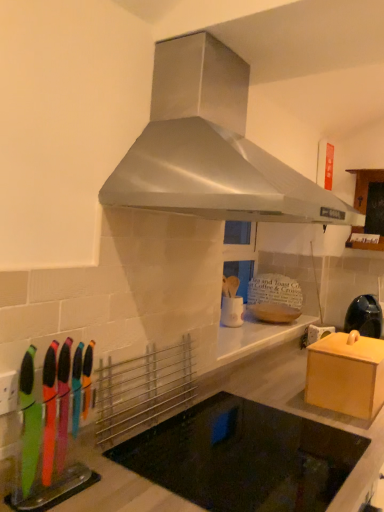
Question: Is there a large distance between wooden cabinet at upper right, positioned as the 2th cabinetry in bottom-to-top order, and matte black kettle at right?

Choices:
 (A) no
 (B) yes

Answer: (A)

Question: Is wooden cabinet at upper right, positioned as the 2th cabinetry in front-to-back order, located outside matte black kettle at right?

Choices:
 (A) no
 (B) yes

Answer: (B)

Question: Is wooden cabinet at upper right, acting as the first cabinetry starting from the right, looking in the opposite direction of matte black kettle at right?

Choices:
 (A) no
 (B) yes

Answer: (A)

Question: From the image's perspective, is wooden cabinet at upper right, arranged as the first cabinetry when viewed from the back, under matte black kettle at right?

Choices:
 (A) yes
 (B) no

Answer: (B)

Question: Considering the relative sizes of wooden cabinet at upper right, positioned as the 2th cabinetry in bottom-to-top order, and matte black kettle at right in the image provided, is wooden cabinet at upper right, positioned as the 2th cabinetry in bottom-to-top order, bigger than matte black kettle at right?

Choices:
 (A) no
 (B) yes

Answer: (B)

Question: From the image's perspective, is wooden box at right, the 1th cabinetry from the bottom, above or below wooden cabinet at upper right, acting as the first cabinetry starting from the right?

Choices:
 (A) below
 (B) above

Answer: (A)

Question: Considering the positions of point (362, 404) and point (377, 210), is point (362, 404) closer or farther from the camera than point (377, 210)?

Choices:
 (A) farther
 (B) closer

Answer: (B)

Question: Looking at their shapes, would you say wooden box at right, the 2th cabinetry when ordered from back to front, is wider or thinner than wooden cabinet at upper right, which is counted as the second cabinetry, starting from the left?

Choices:
 (A) wide
 (B) thin

Answer: (A)

Question: Is wooden box at right, positioned as the 1th cabinetry in front-to-back order, to the left or to the right of wooden cabinet at upper right, arranged as the first cabinetry when viewed from the back, in the image?

Choices:
 (A) left
 (B) right

Answer: (A)

Question: Considering the relative positions of stainless steel range hood at upper center and matte black kettle at right in the image provided, is stainless steel range hood at upper center to the left or to the right of matte black kettle at right?

Choices:
 (A) right
 (B) left

Answer: (B)

Question: Does point (274, 205) appear closer or farther from the camera than point (372, 328)?

Choices:
 (A) closer
 (B) farther

Answer: (A)

Question: In the image, is stainless steel range hood at upper center positioned in front of or behind matte black kettle at right?

Choices:
 (A) behind
 (B) front

Answer: (B)

Question: From a real-world perspective, is stainless steel range hood at upper center physically located above or below matte black kettle at right?

Choices:
 (A) below
 (B) above

Answer: (B)

Question: Considering their positions, is stainless steel range hood at upper center located in front of or behind black glass cooktop at center?

Choices:
 (A) behind
 (B) front

Answer: (A)

Question: Considering the positions of stainless steel range hood at upper center and black glass cooktop at center in the image, is stainless steel range hood at upper center taller or shorter than black glass cooktop at center?

Choices:
 (A) tall
 (B) short

Answer: (B)